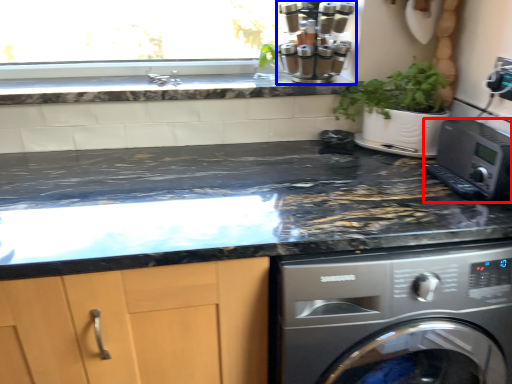
Question: Which of the following is the closest to the observer, home appliance (highlighted by a red box) or coffee machine (highlighted by a blue box)?

Choices:
 (A) home appliance
 (B) coffee machine

Answer: (A)